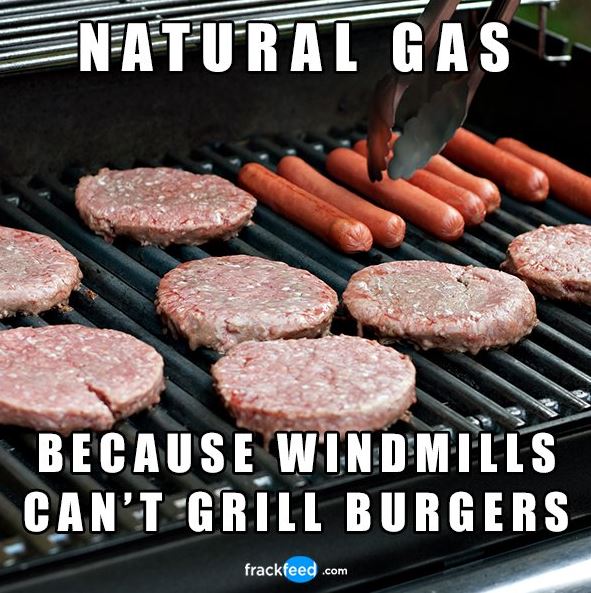
Find the location of `right prong handle`. right prong handle is located at coordinates (x=505, y=3).